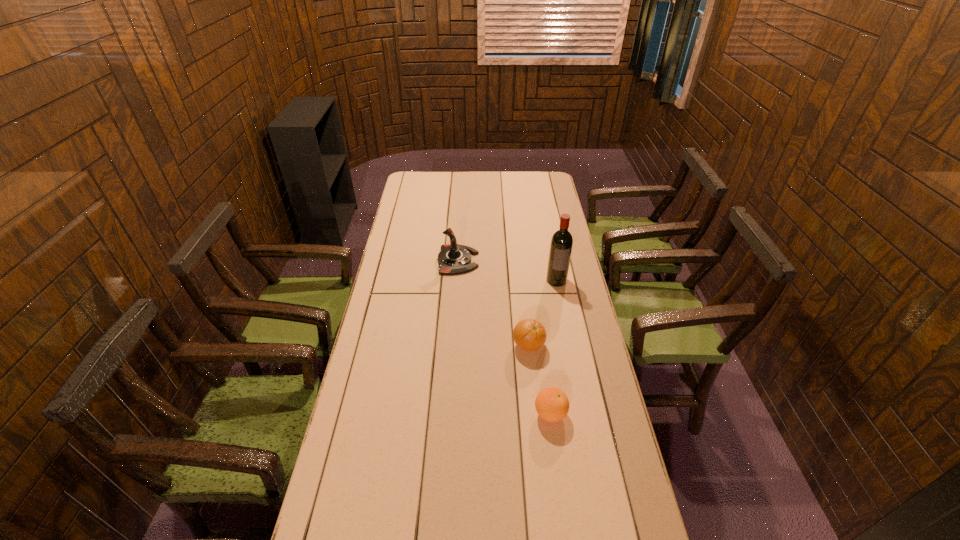
At what (x,y) coordinates should I click in order to perform the action: click on wine bottle positioned at the right edge. Please return your answer as a coordinate pair (x, y). Looking at the image, I should click on (561, 245).

You are a GUI agent. You are given a task and a screenshot of the screen. Output one action in this format:
    pyautogui.click(x=<x>, y=<y>)
    Task: Click on the orange at the right edge
    
    Given the screenshot: What is the action you would take?
    pyautogui.click(x=552, y=404)

The height and width of the screenshot is (540, 960). I want to click on vacant space at the far edge of the desktop, so click(x=479, y=173).

Identify the location of vacant space at the left edge of the desktop. (375, 384).

The image size is (960, 540). In the image, there is a desktop. In order to click on vacant area at the right edge in this screenshot , I will do `click(567, 395)`.

This screenshot has width=960, height=540. Identify the location of free space at the far right corner of the desktop. (537, 193).

Find the location of a particular element. The image size is (960, 540). empty space that is in between the second tallest object and the nearer orange is located at coordinates (504, 337).

Where is `vacant point located between the third shortest object and the rightmost object`? The height and width of the screenshot is (540, 960). vacant point located between the third shortest object and the rightmost object is located at coordinates (507, 271).

Where is `vacant area that lies between the tallest object and the joystick`? Image resolution: width=960 pixels, height=540 pixels. vacant area that lies between the tallest object and the joystick is located at coordinates (507, 271).

You are a GUI agent. You are given a task and a screenshot of the screen. Output one action in this format:
    pyautogui.click(x=<x>, y=<y>)
    Task: Click on the free space between the nearest object and the leftmost object
    The height and width of the screenshot is (540, 960).
    Given the screenshot: What is the action you would take?
    pyautogui.click(x=504, y=337)